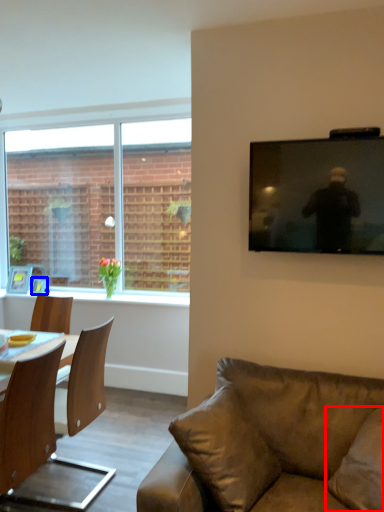
Question: Which point is further to the camera, pillow (highlighted by a red box) or picture frame (highlighted by a blue box)?

Choices:
 (A) pillow
 (B) picture frame

Answer: (B)